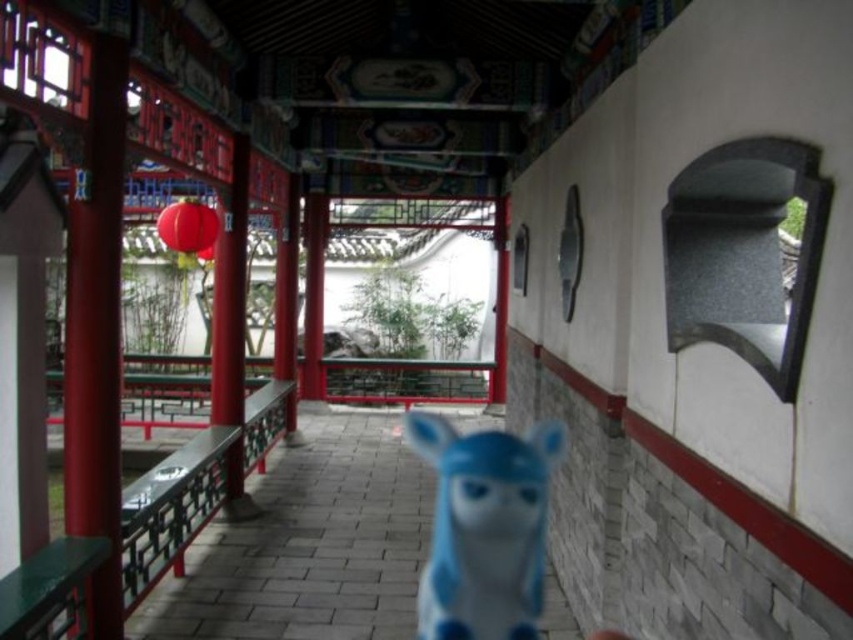
Question: Is blue matte toy at center behind smooth glossy red pillar at center left?

Choices:
 (A) yes
 (B) no

Answer: (B)

Question: Where is smooth glossy red pillar at center left located in relation to matte red paper lantern at upper left in the image?

Choices:
 (A) left
 (B) right

Answer: (B)

Question: Which object is farther from the camera taking this photo?

Choices:
 (A) blue matte toy at center
 (B) matte red paper lantern at upper left
 (C) smooth glossy red pillar at center left

Answer: (C)

Question: Which object is closer to the camera taking this photo?

Choices:
 (A) matte red paper lantern at upper left
 (B) smooth glossy red pillar at center left

Answer: (A)

Question: Among these points, which one is farthest from the camera?

Choices:
 (A) (474, 596)
 (B) (181, 250)

Answer: (B)

Question: Is smooth glossy red pillar at center left closer to the viewer compared to matte red paper lantern at upper left?

Choices:
 (A) no
 (B) yes

Answer: (A)